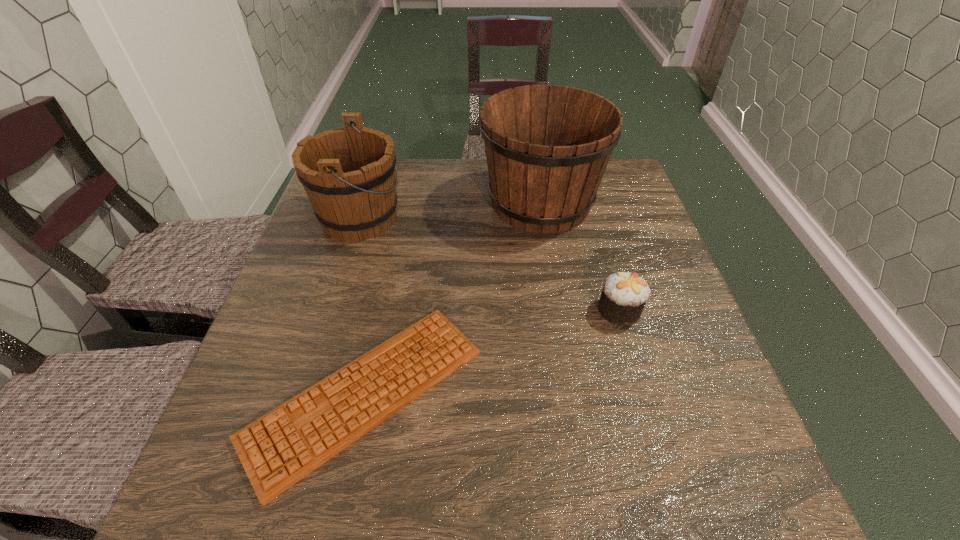
Identify the location of free point at the near right corner. Image resolution: width=960 pixels, height=540 pixels. (757, 503).

I want to click on vacant area that lies between the left wine bucket and the right wine bucket, so click(x=450, y=210).

You are a GUI agent. You are given a task and a screenshot of the screen. Output one action in this format:
    pyautogui.click(x=<x>, y=<y>)
    Task: Click on the free space between the third tallest object and the left wine bucket
    Image resolution: width=960 pixels, height=540 pixels.
    Given the screenshot: What is the action you would take?
    pyautogui.click(x=490, y=264)

Where is `empty location between the shortest object and the right wine bucket`? This screenshot has height=540, width=960. empty location between the shortest object and the right wine bucket is located at coordinates (453, 298).

Identify the location of free point between the right wine bucket and the left wine bucket. Image resolution: width=960 pixels, height=540 pixels. (450, 210).

The image size is (960, 540). What are the coordinates of `empty space that is in between the third tallest object and the shortest object` in the screenshot? It's located at (492, 352).

This screenshot has height=540, width=960. In order to click on free area in between the cupcake and the right wine bucket in this screenshot , I will do `click(580, 256)`.

Find the location of a particular element. This screenshot has width=960, height=540. empty space between the shortest object and the left wine bucket is located at coordinates (362, 306).

The image size is (960, 540). I want to click on vacant region between the computer keyboard and the cupcake, so click(492, 352).

I want to click on free point between the right wine bucket and the left wine bucket, so click(x=450, y=210).